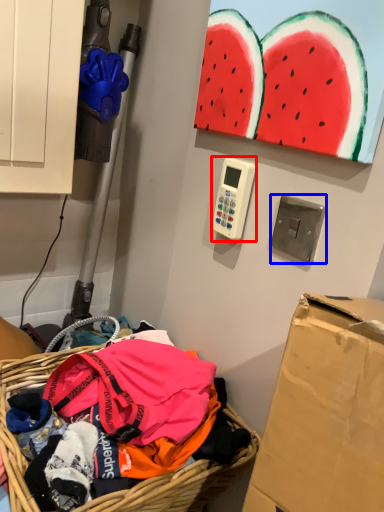
Question: Which object appears farthest to the camera in this image, scale (highlighted by a red box) or light switch (highlighted by a blue box)?

Choices:
 (A) scale
 (B) light switch

Answer: (A)